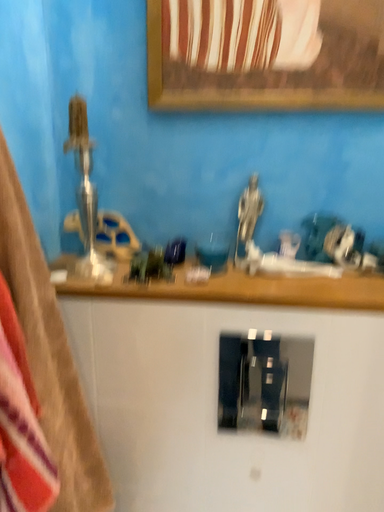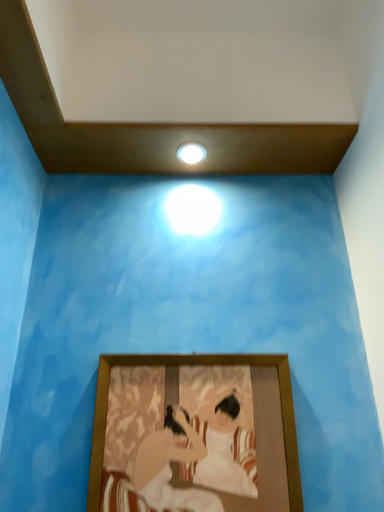
Question: How did the camera likely rotate when shooting the video?

Choices:
 (A) rotated upward
 (B) rotated downward

Answer: (A)